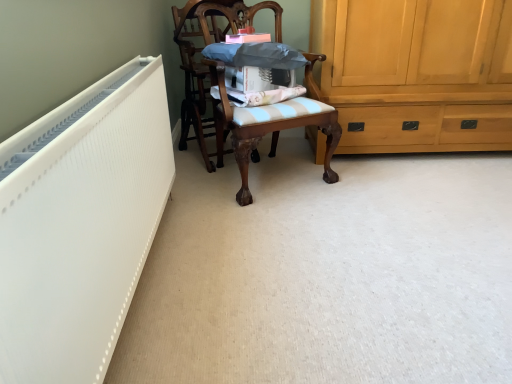
Question: Could you tell me if wooden chair at center, marked as the 1th chair in a left-to-right arrangement, is turned towards wooden chair at center, which is the 1th chair in right-to-left order?

Choices:
 (A) yes
 (B) no

Answer: (A)

Question: Does wooden chair at center, marked as the 1th chair in a left-to-right arrangement, have a smaller size compared to wooden chair at center, which is the 1th chair in right-to-left order?

Choices:
 (A) no
 (B) yes

Answer: (B)

Question: From the image's perspective, is wooden chair at center, which appears as the 2th chair when viewed from the right, beneath wooden chair at center, the 2th chair when ordered from left to right?

Choices:
 (A) no
 (B) yes

Answer: (A)

Question: Does wooden chair at center, which appears as the 2th chair when viewed from the right, have a larger size compared to wooden chair at center, which is the 1th chair in right-to-left order?

Choices:
 (A) yes
 (B) no

Answer: (B)

Question: Is wooden chair at center, marked as the 1th chair in a left-to-right arrangement, looking in the opposite direction of wooden chair at center, which is the 1th chair in right-to-left order?

Choices:
 (A) yes
 (B) no

Answer: (B)

Question: Is wooden chair at center, marked as the 1th chair in a left-to-right arrangement, behind wooden chair at center, which is the 1th chair in right-to-left order?

Choices:
 (A) no
 (B) yes

Answer: (B)

Question: From a real-world perspective, is wooden chair at center, the 2th chair when ordered from left to right, located higher than wooden chair at center, which appears as the 2th chair when viewed from the right?

Choices:
 (A) no
 (B) yes

Answer: (A)

Question: Is wooden chair at center, the 2th chair when ordered from left to right, thinner than wooden chair at center, which appears as the 2th chair when viewed from the right?

Choices:
 (A) yes
 (B) no

Answer: (B)

Question: Does wooden chair at center, the 2th chair when ordered from left to right, appear on the left side of wooden chair at center, marked as the 1th chair in a left-to-right arrangement?

Choices:
 (A) no
 (B) yes

Answer: (A)

Question: Is wooden chair at center, which is the 1th chair in right-to-left order, to the right of wooden chair at center, marked as the 1th chair in a left-to-right arrangement, from the viewer's perspective?

Choices:
 (A) no
 (B) yes

Answer: (B)

Question: From a real-world perspective, is wooden chair at center, the 2th chair when ordered from left to right, positioned under wooden chair at center, marked as the 1th chair in a left-to-right arrangement, based on gravity?

Choices:
 (A) yes
 (B) no

Answer: (A)

Question: Can we say wooden chair at center, the 2th chair when ordered from left to right, lies outside wooden chair at center, marked as the 1th chair in a left-to-right arrangement?

Choices:
 (A) yes
 (B) no

Answer: (A)

Question: Is wooden chair at center, which appears as the 2th chair when viewed from the right, taller than light brown wood cabinet at right?

Choices:
 (A) yes
 (B) no

Answer: (A)